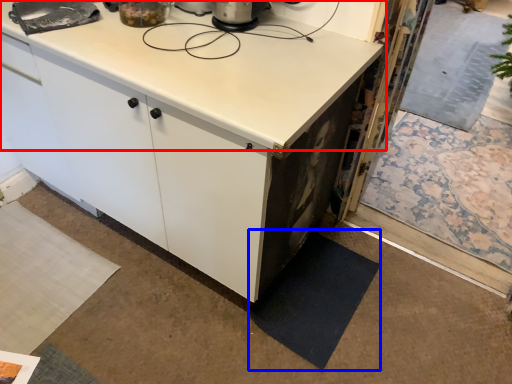
Question: Which point is closer to the camera, countertop (highlighted by a red box) or mat (highlighted by a blue box)?

Choices:
 (A) countertop
 (B) mat

Answer: (A)